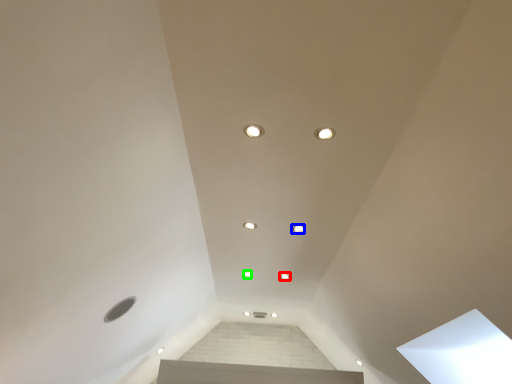
Question: Which is farther away from dot (highlighted by a red box)? dot (highlighted by a blue box) or dot (highlighted by a green box)?

Choices:
 (A) dot
 (B) dot

Answer: (A)